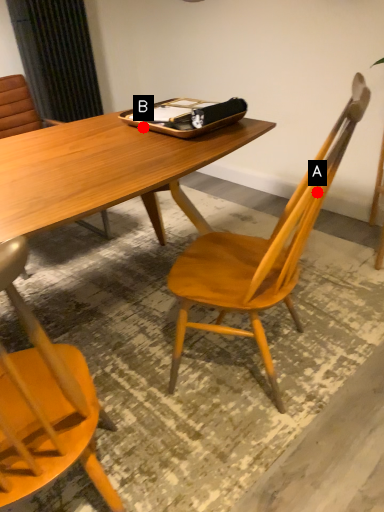
Question: Two points are circled on the image, labeled by A and B beside each circle. Which point is farther from the camera taking this photo?

Choices:
 (A) A is further
 (B) B is further

Answer: (B)